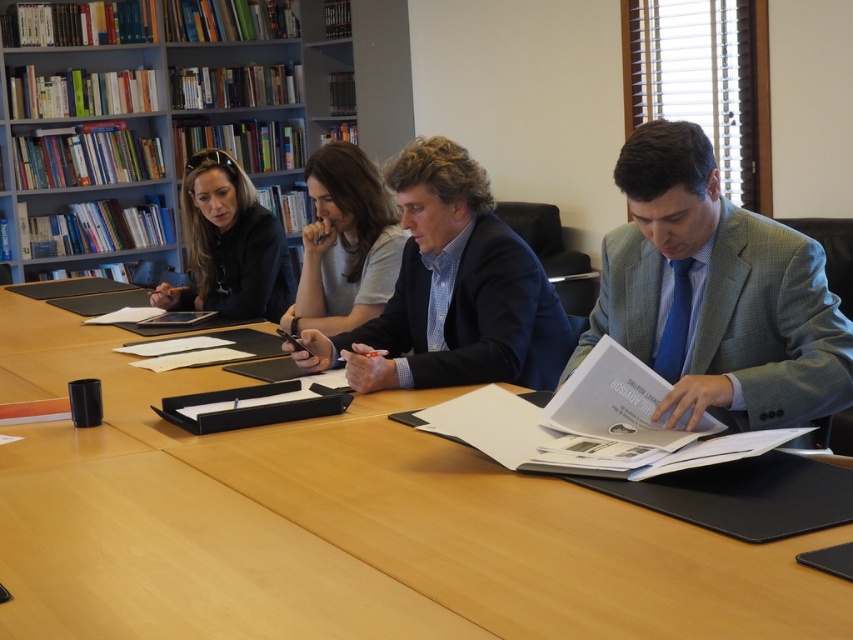
Between point (372, 216) and point (167, 296), which one is positioned in front?

Point (372, 216) is more forward.

Between matte gray shirt at center and matte black tablet at upper left, which one appears on the left side from the viewer's perspective?

From the viewer's perspective, matte black tablet at upper left appears more on the left side.

Is point (334, 244) in front of point (285, 296)?

Yes, it is in front of point (285, 296).

I want to click on matte gray shirt at center, so click(345, 243).

Is wooden bookshelf at upper left above matte gray shirt at center?

Correct, wooden bookshelf at upper left is located above matte gray shirt at center.

Is point (196, 13) farther from viewer compared to point (309, 257)?

Yes, point (196, 13) is farther from viewer.

Where is `wooden bookshelf at upper left`? wooden bookshelf at upper left is located at coordinates (144, 124).

Does wooden bookshelf at upper left have a lesser width compared to gray checkered suit at right?

No.

Who is more forward, (x=15, y=241) or (x=758, y=346)?

Point (x=758, y=346) is more forward.

The width and height of the screenshot is (853, 640). Identify the location of wooden bookshelf at upper left. (144, 124).